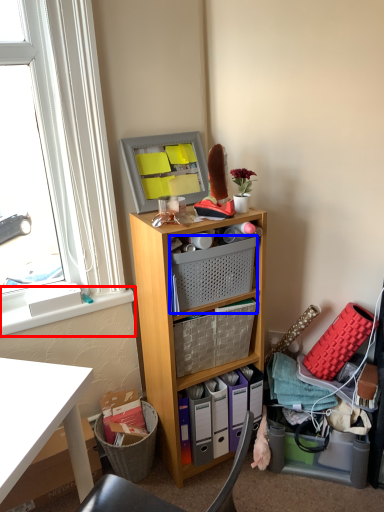
Question: Among these objects, which one is nearest to the camera, window sill (highlighted by a red box) or basket (highlighted by a blue box)?

Choices:
 (A) window sill
 (B) basket

Answer: (B)